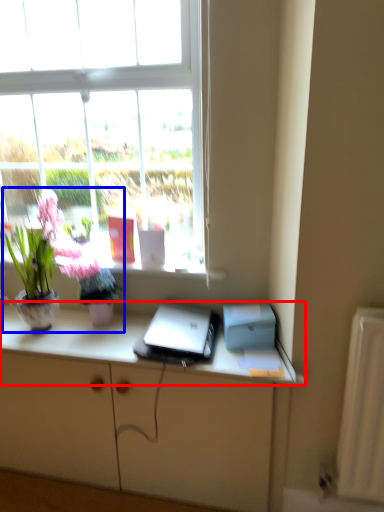
Question: Among these objects, which one is nearest to the camera, desk (highlighted by a red box) or houseplant (highlighted by a blue box)?

Choices:
 (A) desk
 (B) houseplant

Answer: (A)